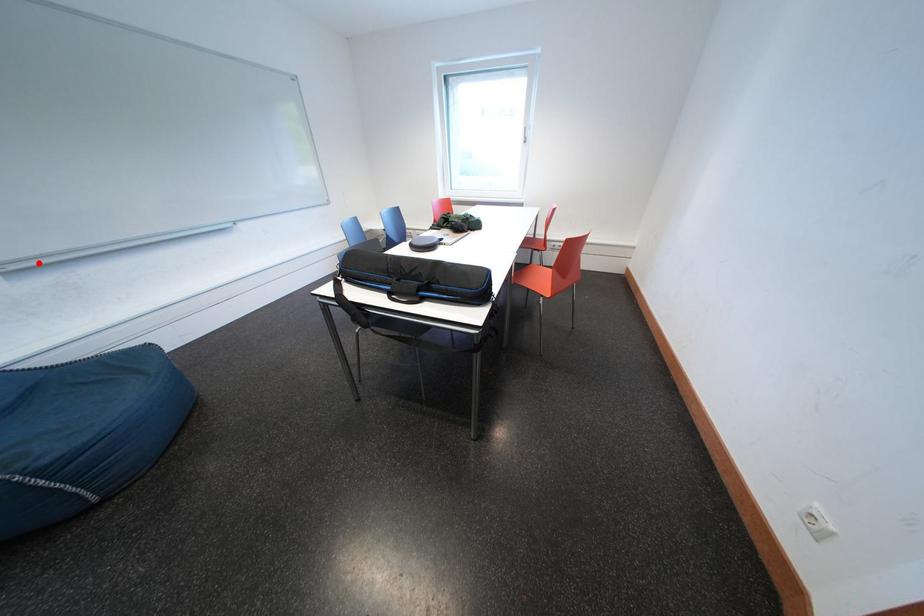
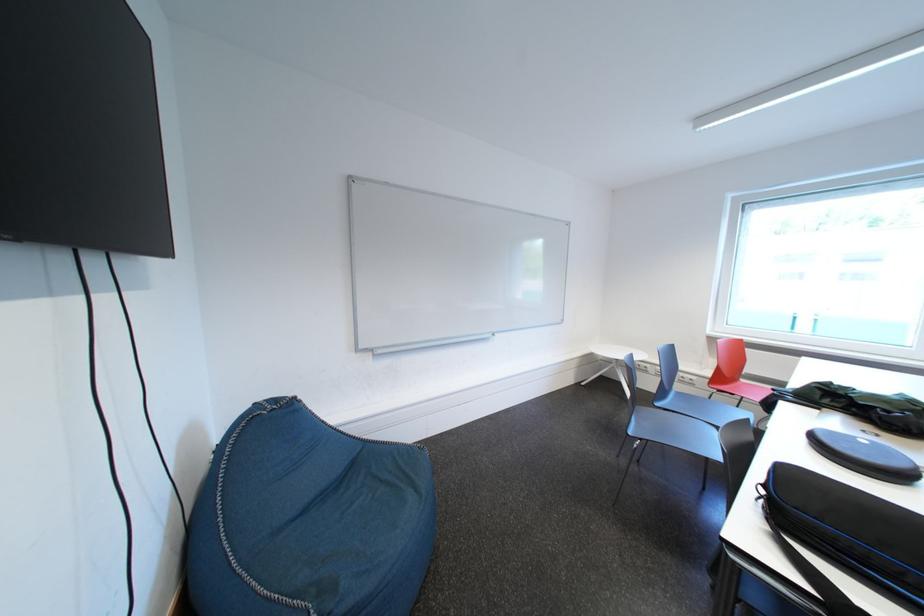
Find the pixel in the second image that matches the highlighted location in the first image.

(397, 351)